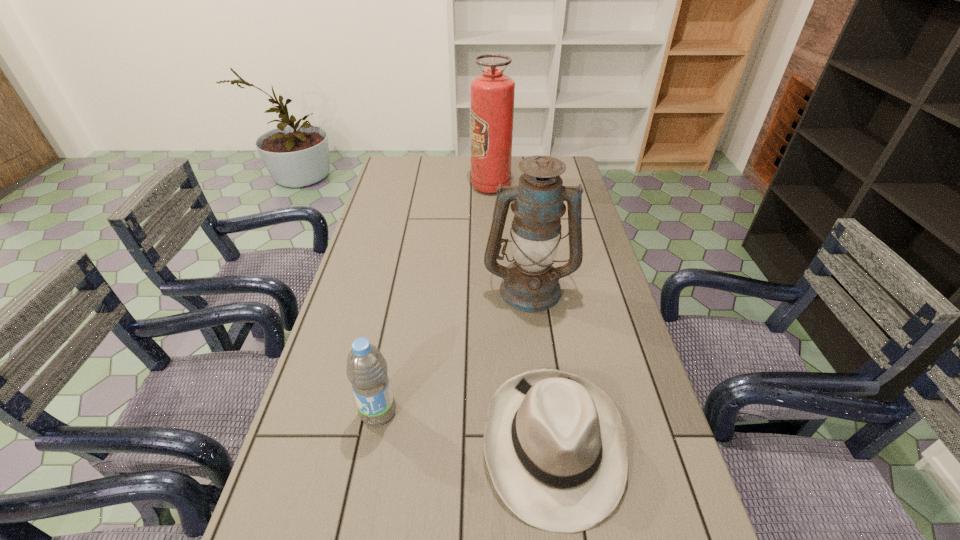
The image size is (960, 540). I want to click on the farthest object, so click(x=492, y=93).

Locate an element on the screen. the third nearest object is located at coordinates (531, 284).

At what (x,y) coordinates should I click in order to perform the action: click on water bottle. Please return your answer as a coordinate pair (x, y). The width and height of the screenshot is (960, 540). Looking at the image, I should click on (367, 369).

The image size is (960, 540). In order to click on the leftmost object in this screenshot , I will do `click(367, 369)`.

Where is `fedora`? fedora is located at coordinates (555, 445).

The width and height of the screenshot is (960, 540). What are the coordinates of `vacant space located on the label side of the fire extinguisher` in the screenshot? It's located at (389, 186).

Locate an element on the screen. Image resolution: width=960 pixels, height=540 pixels. free space located on the label side of the fire extinguisher is located at coordinates (421, 186).

The width and height of the screenshot is (960, 540). In order to click on free space located on the label side of the fire extinguisher in this screenshot , I will do `click(456, 186)`.

I want to click on free location located on the left of the oil lamp, so click(x=362, y=288).

Where is `vacant region located on the back of the second shortest object`? vacant region located on the back of the second shortest object is located at coordinates (398, 310).